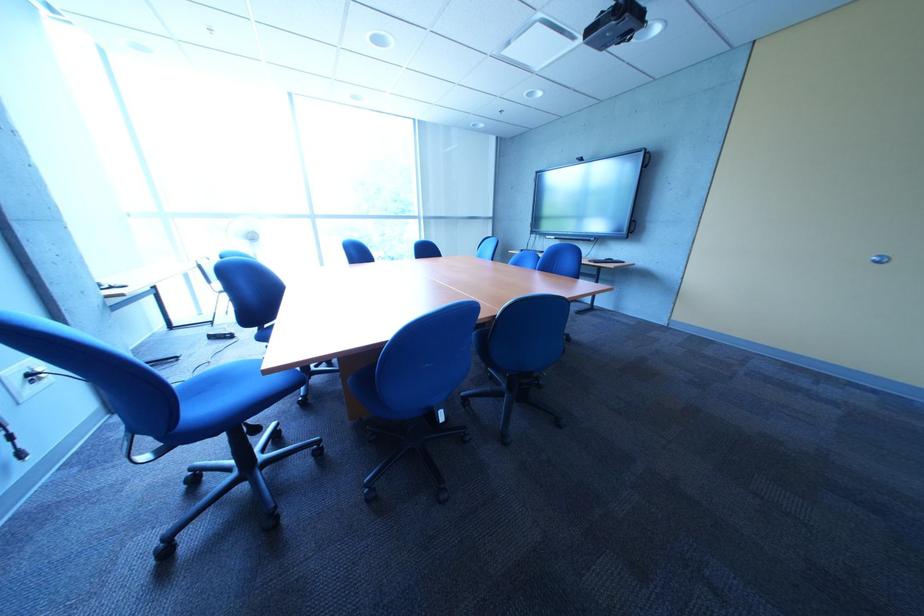
Where would you pull the round door handle? Please return your answer as a coordinate pair (x, y).

(880, 259)